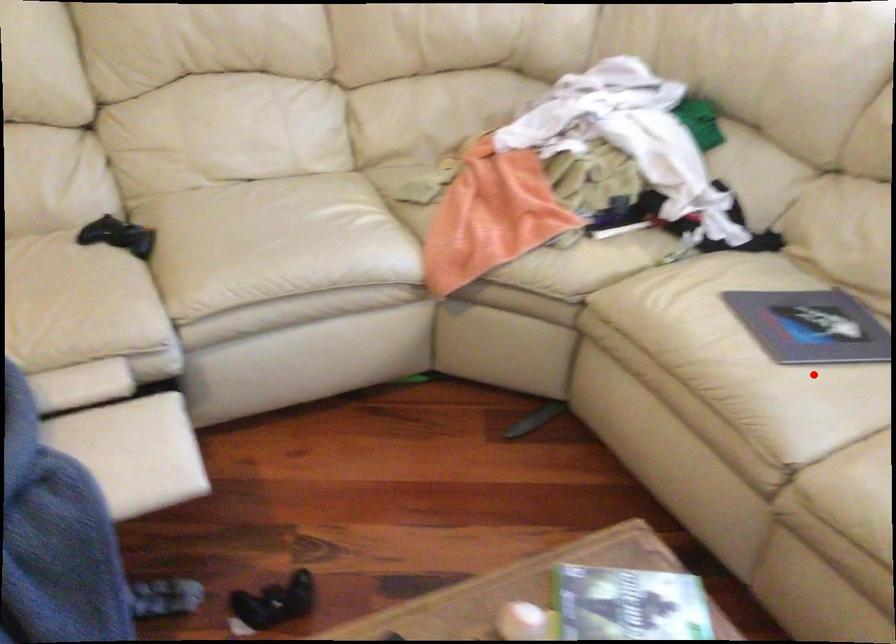
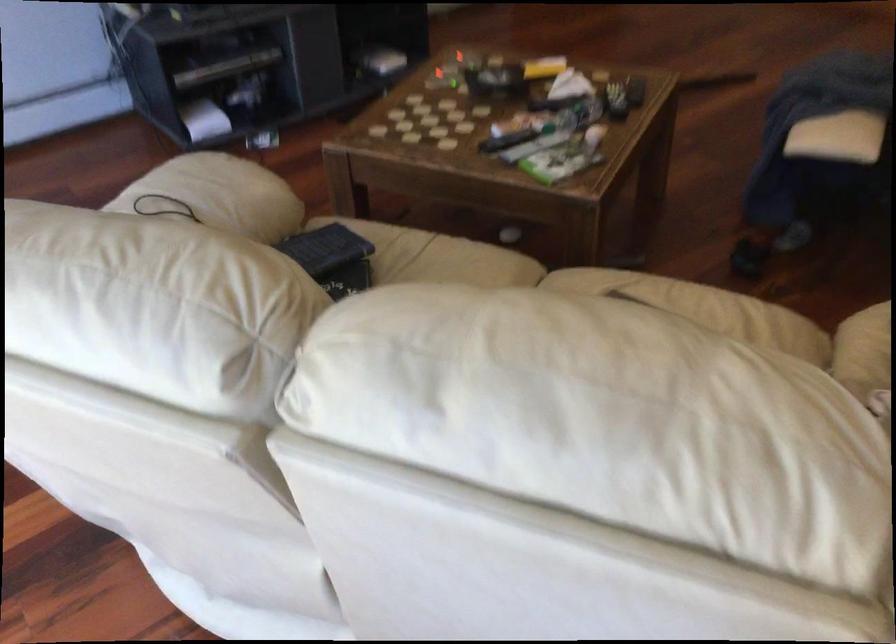
Question: I am providing you with two images of the same scene from different viewpoints. A red point is shown in image1. For the corresponding object point in image2, is it positioned nearer or farther from the camera?

Choices:
 (A) Nearer
 (B) Farther

Answer: (B)